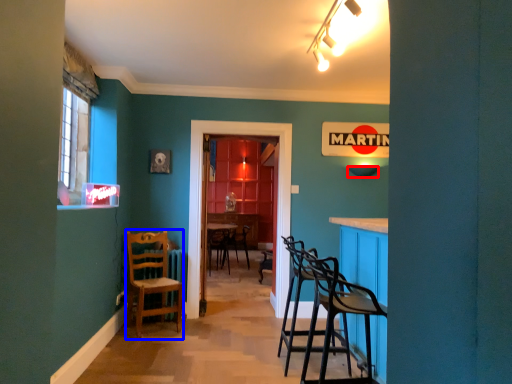
Question: Which object appears farthest to the camera in this image, lampshade (highlighted by a red box) or chair (highlighted by a blue box)?

Choices:
 (A) lampshade
 (B) chair

Answer: (A)